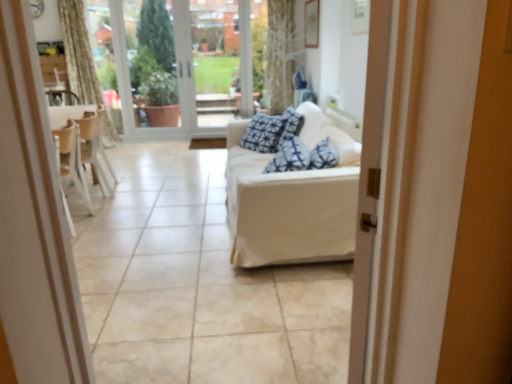
Question: From the image's perspective, is white fabric couch at center above or below white glass door at upper center?

Choices:
 (A) above
 (B) below

Answer: (B)

Question: Considering the positions of white fabric couch at center and white glass door at upper center in the image, is white fabric couch at center wider or thinner than white glass door at upper center?

Choices:
 (A) thin
 (B) wide

Answer: (B)

Question: Estimate the real-world distances between objects in this image. Which object is closer to the white glass door at upper center?

Choices:
 (A) white fabric couch at center
 (B) transparent glass door at center
 (C) white fabric couch at center
 (D) wooden chair at left

Answer: (B)

Question: Estimate the real-world distances between objects in this image. Which object is closer to the wooden chair at left?

Choices:
 (A) transparent glass door at center
 (B) white fabric couch at center
 (C) white fabric couch at center
 (D) white glass door at upper center

Answer: (B)